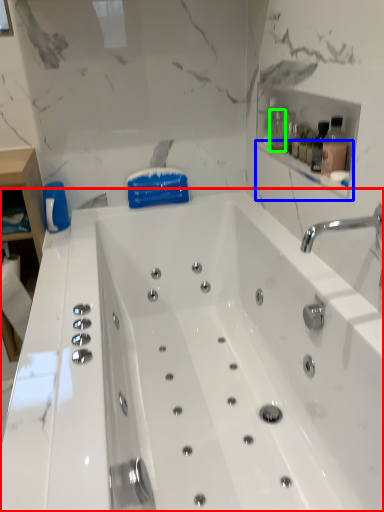
Question: Which is farther away from bathtub (highlighted by a red box)? balustrade (highlighted by a blue box) or bottle (highlighted by a green box)?

Choices:
 (A) balustrade
 (B) bottle

Answer: (B)